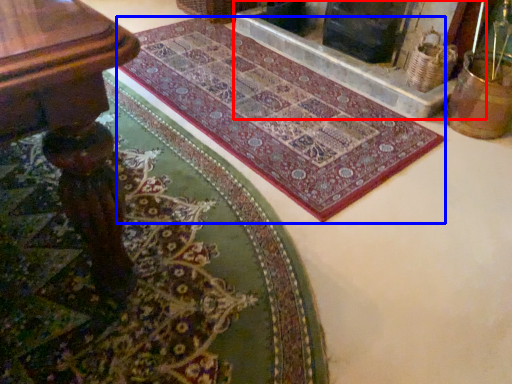
Question: Which of the following is the closest to the observer, fireplace (highlighted by a red box) or mat (highlighted by a blue box)?

Choices:
 (A) fireplace
 (B) mat

Answer: (B)